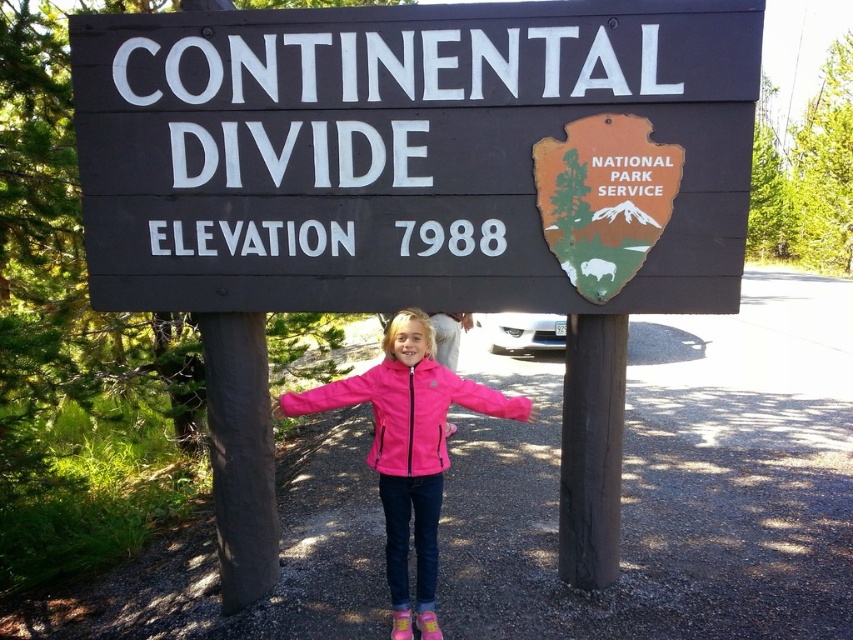
You are a photographer trying to capture the perfect shot of the girl and the sign. You notice two points on the sign labeled as point 1 at coordinates point (241, 554) and point 2 at coordinates point (383, 413). Which point is closer to your camera?

Point (241, 554) is further to the camera than point (383, 413), so point (383, 413) is closer to the camera.

You are taking a photo of the girl and the sign. The girl is standing at point (722, 22) and the sign is at point (312, 406). Which point is closer to the camera?

Point (722, 22) is closer to the camera than point (312, 406).

You are a photographer trying to capture the brown wood pole at left and the pink fleece jacket at center in the same frame. Based on their positions, which object is closer to the bottom of the photo?

The brown wood pole at left is located below the pink fleece jacket at center, so it is closer to the bottom of the photo.